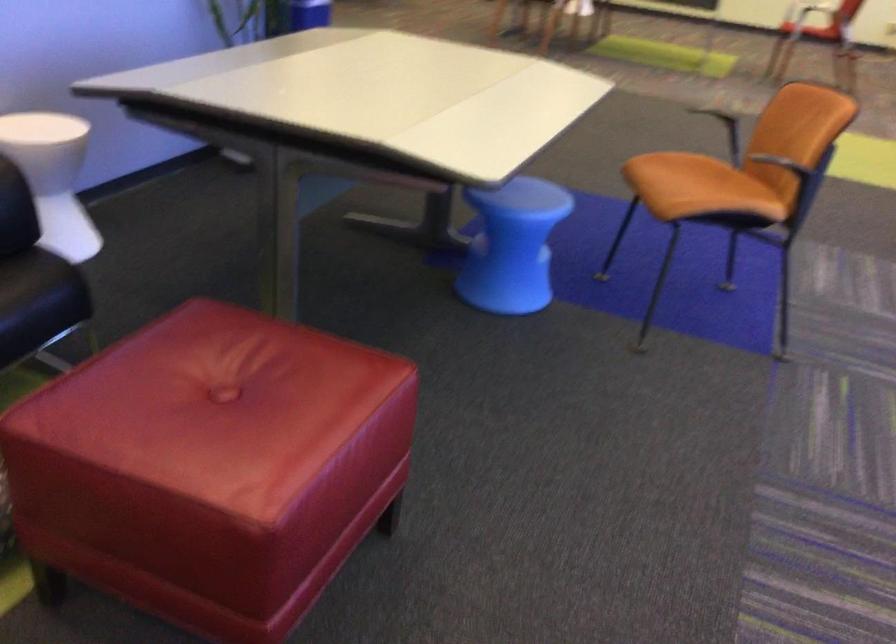
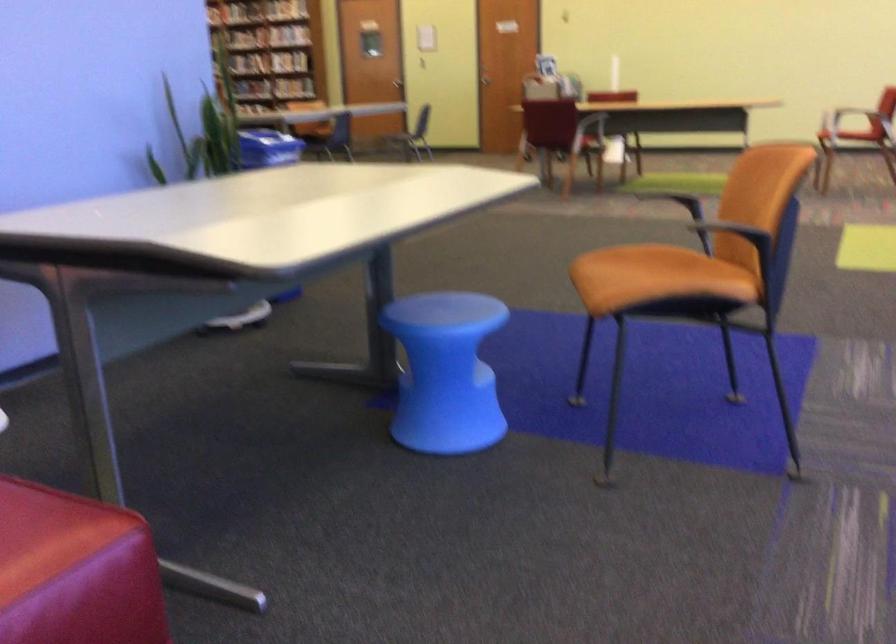
Locate, in the second image, the point that corresponds to point (357, 375) in the first image.

(47, 534)